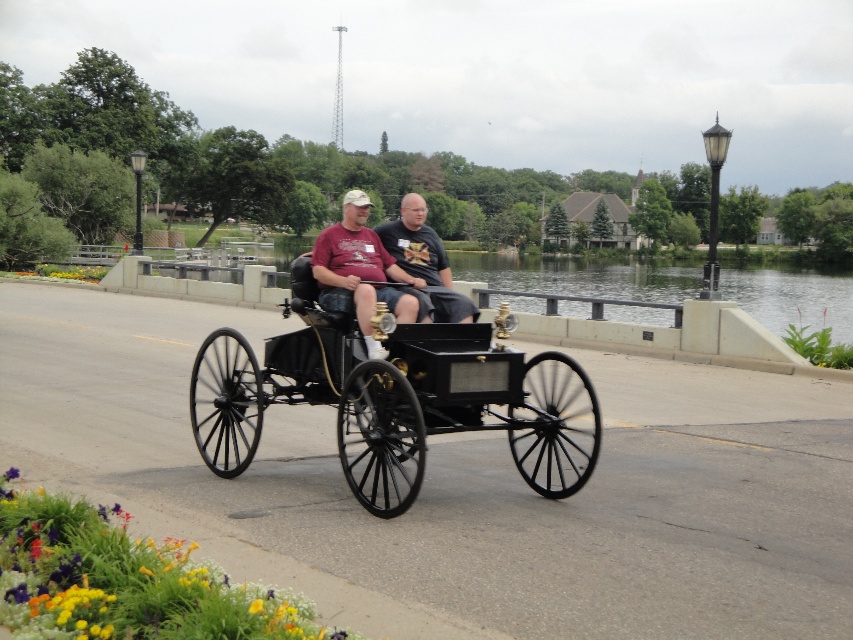
You are a tourist standing on the bridge and want to take a photo of the matte black buggy at center and the dark gray fabric shirt at center. Which object should you point your camera towards first if you want to capture both in the frame?

You should first point your camera towards the dark gray fabric shirt at center because the matte black buggy at center is to the right of it, so capturing the shirt first will allow both objects to be in the frame.

You are a tourist trying to locate the matte black buggy at center on a map of the bridge. According to the coordinates provided, where would you mark its position?

The matte black buggy at center is located at point coordinates (360,269), so you should mark it at those coordinates on the map.

You are standing on the bridge and want to take a photo of the black polished wood horse cart at center. If your camera can focus on objects up to 7 meters away, will it be able to capture the cart clearly?

The black polished wood horse cart at center is 6.87 meters away from the viewer. Since the camera can focus up to 7 meters, it will be able to capture the cart clearly.